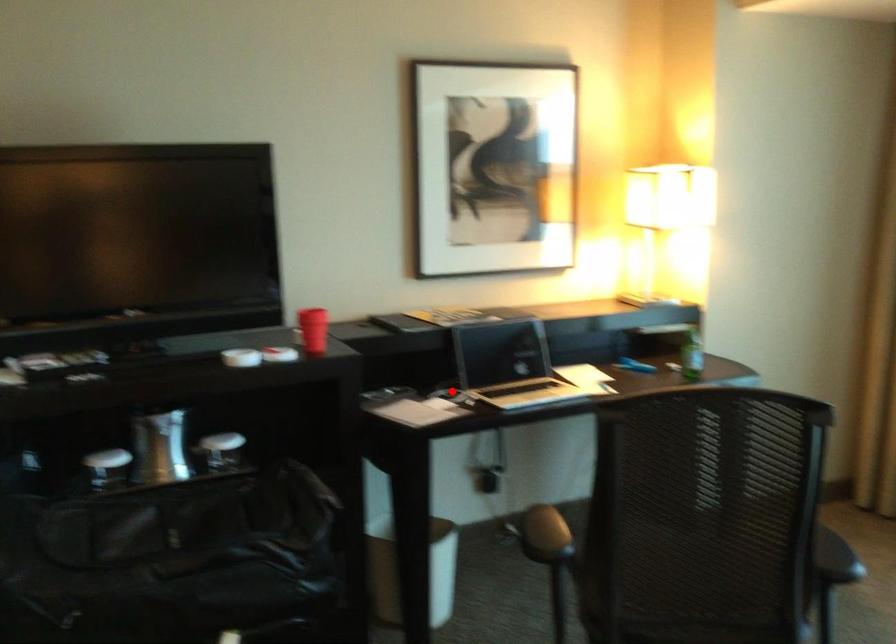
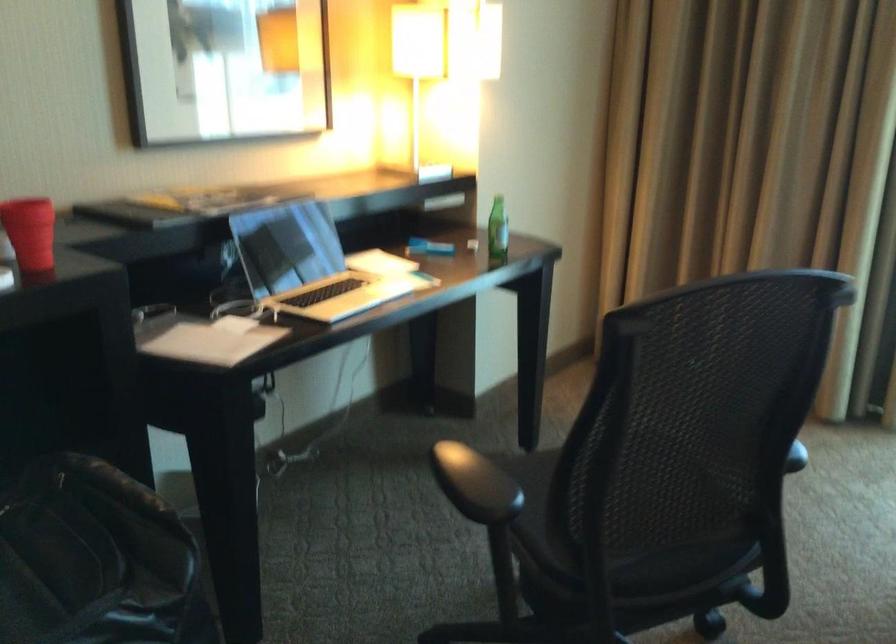
The point at the highlighted location is marked in the first image. Where is the corresponding point in the second image?

(237, 304)